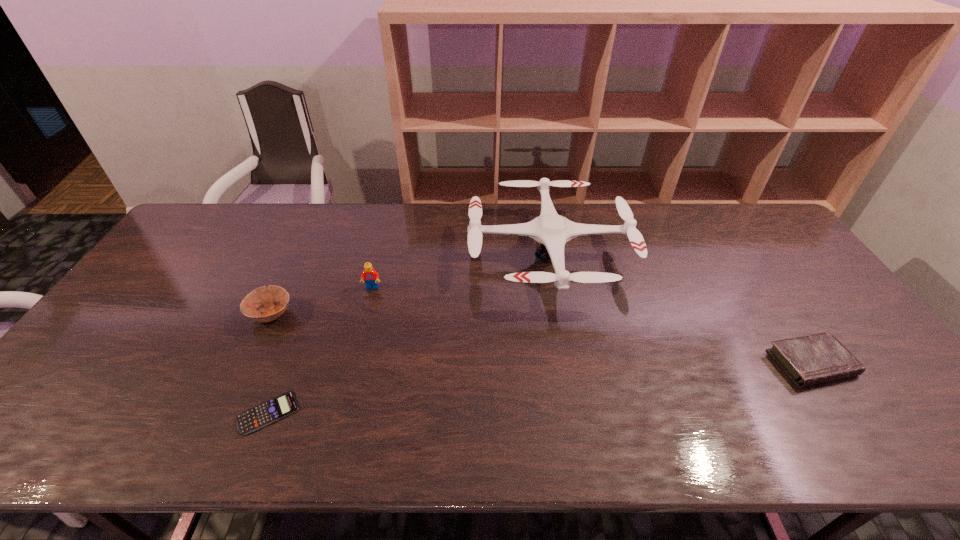
Where is `vacant space that is in between the third shortest object and the fourth object from left to right`? Image resolution: width=960 pixels, height=540 pixels. vacant space that is in between the third shortest object and the fourth object from left to right is located at coordinates (410, 285).

Identify which object is located as the fourth nearest to the third tallest object. Please provide its 2D coordinates. Your answer should be formatted as a tuple, i.e. [(x, y)], where the tuple contains the x and y coordinates of a point satisfying the conditions above.

[(817, 358)]

The image size is (960, 540). I want to click on object that is the closest to the drone, so click(x=371, y=277).

Locate an element on the screen. The image size is (960, 540). free spot that satisfies the following two spatial constraints: 1. with the camera attached at the bottom of the second object from right to left; 2. on the left side of the fourth farthest object is located at coordinates (567, 363).

The image size is (960, 540). What are the coordinates of `free location that satisfies the following two spatial constraints: 1. with the camera attached at the bottom of the tallest object; 2. on the right side of the fourth farthest object` in the screenshot? It's located at (567, 363).

Find the location of a particular element. vacant region that satisfies the following two spatial constraints: 1. with the camera attached at the bottom of the drone; 2. on the right side of the second shortest object is located at coordinates (567, 363).